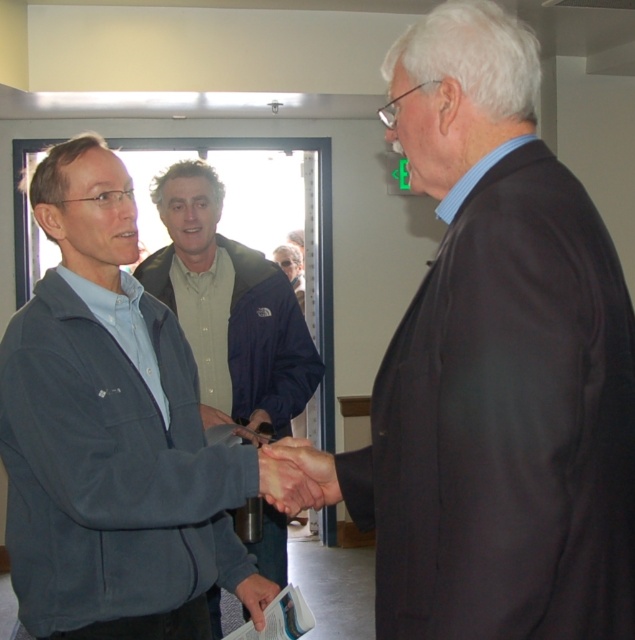
You are standing at the origin point in the image. There are two points marked in the scene, point 1 at coordinates point 1 at coordinates point (x=302, y=500) and point 2 at coordinates point (x=255, y=596). Which point is closer to you?

Point 1 at coordinates point (x=302, y=500) is closer to you because it is in front of point 2 at coordinates point (x=255, y=596).

You are a photographer at the event and want to capture a closeup of the dark gray fleece jacket at left and the smooth skin handshake at center. Which object should you zoom in on first to ensure it fits in the frame?

The dark gray fleece jacket at left is larger in size compared to the smooth skin handshake at center, so you should zoom in on the dark gray fleece jacket at left first to ensure it fits in the frame.